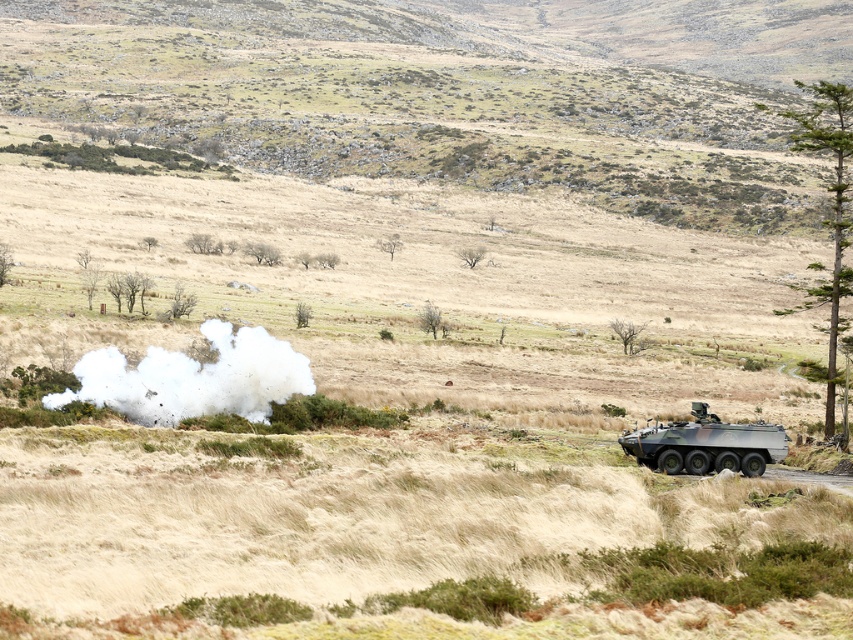
Which is in front, point (213, 328) or point (692, 401)?

Point (213, 328) is more forward.

Image resolution: width=853 pixels, height=640 pixels. Find the location of `white fluffy cloud at left`. white fluffy cloud at left is located at coordinates click(193, 378).

At what (x,y) coordinates should I click in order to perform the action: click on white fluffy cloud at left. Please return your answer as a coordinate pair (x, y). The height and width of the screenshot is (640, 853). Looking at the image, I should click on (193, 378).